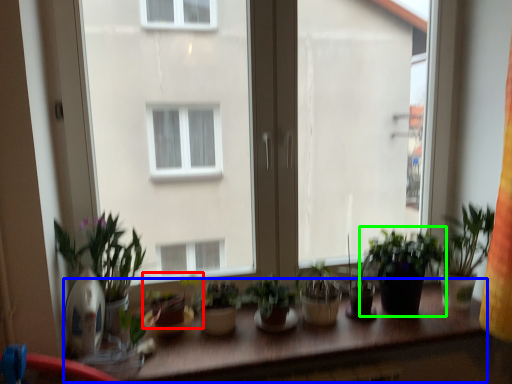
Question: Based on their relative distances, which object is farther from houseplant (highlighted by a red box)? Choose from table (highlighted by a blue box) and houseplant (highlighted by a green box).

Choices:
 (A) table
 (B) houseplant

Answer: (B)